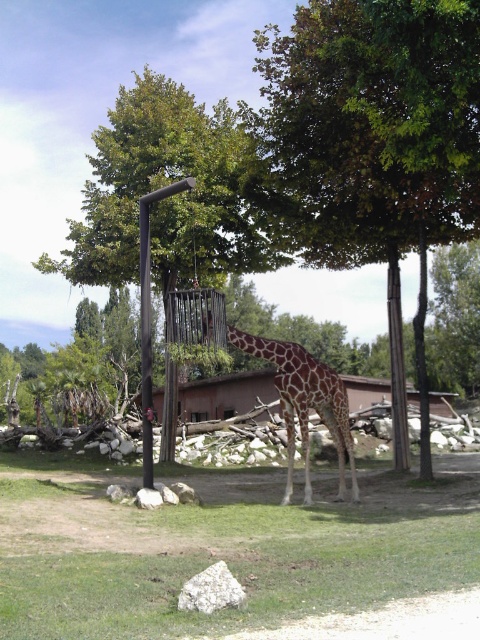
Question: Is green grass at lower center to the right of black metal pole at center from the viewer's perspective?

Choices:
 (A) no
 (B) yes

Answer: (B)

Question: Which point is farther to the camera?

Choices:
 (A) 294,218
 (B) 78,483
 (C) 151,428
 (D) 335,420

Answer: (A)

Question: Is the position of green leafy tree at center more distant than that of spotted fur giraffe at center?

Choices:
 (A) yes
 (B) no

Answer: (B)

Question: Is green grass at lower center positioned in front of black metal pole at center?

Choices:
 (A) no
 (B) yes

Answer: (B)

Question: Which point is farther to the camera?

Choices:
 (A) green leafy tree at center
 (B) green grass at lower center
 (C) black metal pole at center

Answer: (C)

Question: Which object appears closest to the camera in this image?

Choices:
 (A) green leafy tree at center
 (B) black metal pole at center
 (C) spotted fur giraffe at center
 (D) green grass at lower center

Answer: (D)